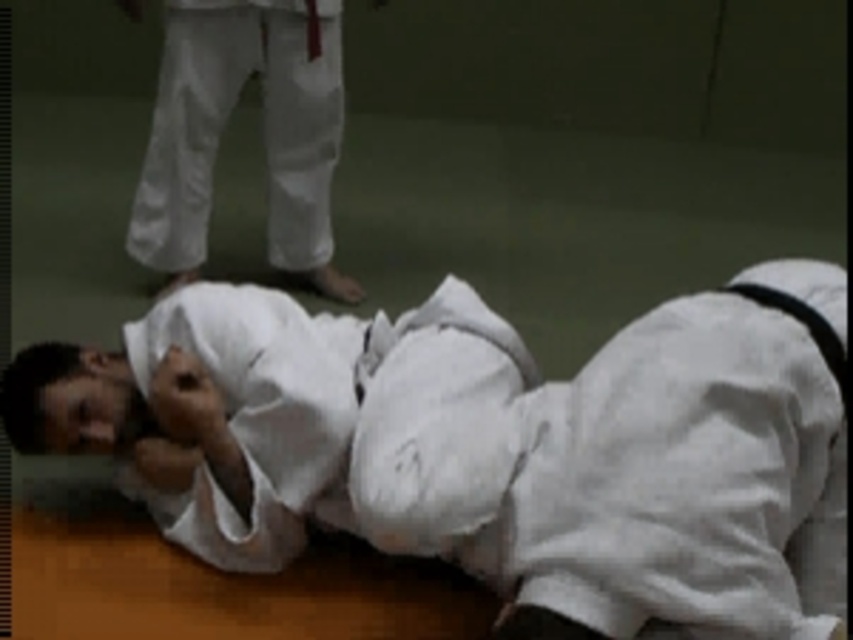
You are a judo instructor observing a training session. You notice the white cloth kimono at lower left and the white cotton pants at upper center. Which piece of clothing is bigger in size?

The white cloth kimono at lower left is larger in size compared to the white cotton pants at upper center.

Based on the photo, you are a judo instructor observing a training session. You notice a point at coordinates (483,449) in the image. Which object in the scene corresponds to this point?

The point at (483,449) corresponds to the white cloth kimono at lower left.